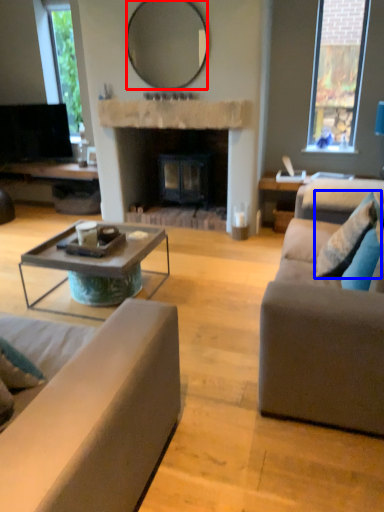
Question: Which of the following is the farthest to the observer, mirror (highlighted by a red box) or pillow (highlighted by a blue box)?

Choices:
 (A) mirror
 (B) pillow

Answer: (A)